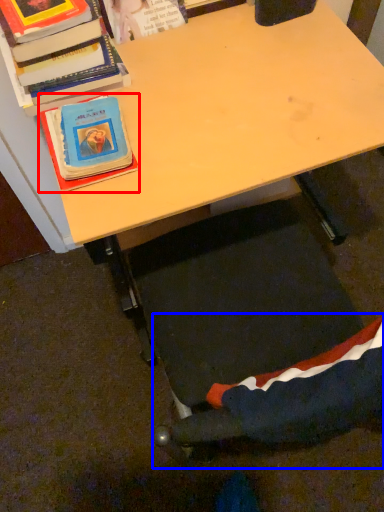
Question: Which object is closer to the camera taking this photo, book (highlighted by a red box) or swivel chair (highlighted by a blue box)?

Choices:
 (A) book
 (B) swivel chair

Answer: (B)